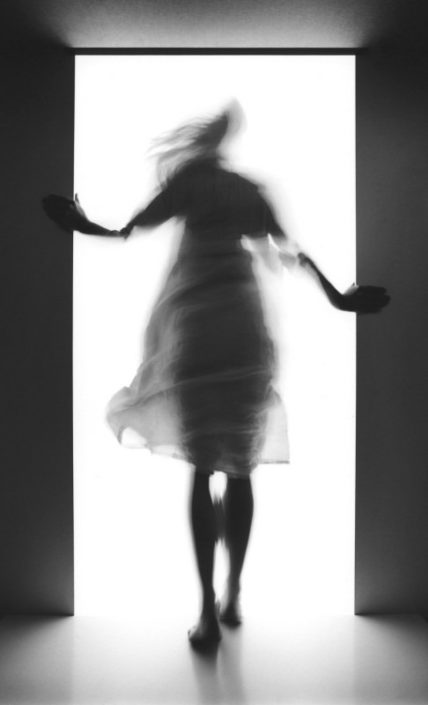
You are a GUI agent. You are given a task and a screenshot of the screen. Output one action in this format:
    pyautogui.click(x=<x>, y=<y>)
    Task: Click on the floor
    The height and width of the screenshot is (705, 428).
    Given the screenshot: What is the action you would take?
    pyautogui.click(x=46, y=689), pyautogui.click(x=394, y=673)